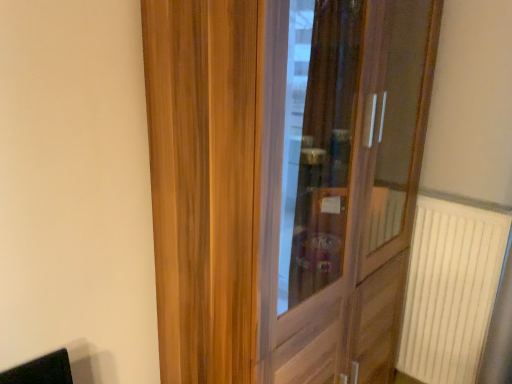
Question: Is wooden door at center wider or thinner than white plastic radiator at right?

Choices:
 (A) thin
 (B) wide

Answer: (B)

Question: Considering their positions, is wooden door at center located in front of or behind white plastic radiator at right?

Choices:
 (A) behind
 (B) front

Answer: (B)

Question: From their relative heights in the image, would you say wooden door at center is taller or shorter than white plastic radiator at right?

Choices:
 (A) short
 (B) tall

Answer: (B)

Question: Considering their positions, is white plastic radiator at right located in front of or behind wooden door at center?

Choices:
 (A) behind
 (B) front

Answer: (A)

Question: From the image's perspective, relative to wooden door at center, is white plastic radiator at right above or below?

Choices:
 (A) below
 (B) above

Answer: (A)

Question: Considering the positions of white plastic radiator at right and wooden door at center in the image, is white plastic radiator at right wider or thinner than wooden door at center?

Choices:
 (A) wide
 (B) thin

Answer: (B)

Question: Do you think white plastic radiator at right is within wooden door at center, or outside of it?

Choices:
 (A) inside
 (B) outside

Answer: (B)